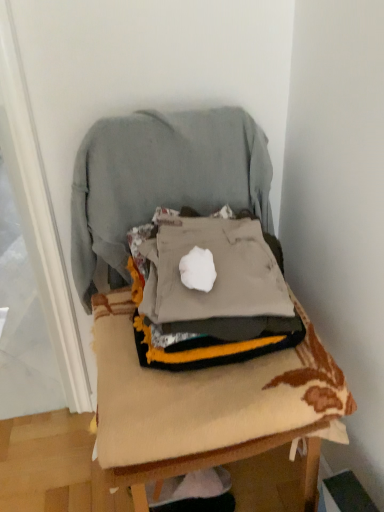
Question: Considering the relative sizes of gray fabric at center and textured beige cushion at center in the image provided, is gray fabric at center taller than textured beige cushion at center?

Choices:
 (A) no
 (B) yes

Answer: (A)

Question: Considering the relative positions of gray fabric at center and textured beige cushion at center in the image provided, is gray fabric at center to the right of textured beige cushion at center from the viewer's perspective?

Choices:
 (A) no
 (B) yes

Answer: (B)

Question: Is gray fabric at center positioned in front of textured beige cushion at center?

Choices:
 (A) no
 (B) yes

Answer: (A)

Question: From the image's perspective, is gray fabric at center below textured beige cushion at center?

Choices:
 (A) yes
 (B) no

Answer: (A)

Question: Would you say gray fabric at center is outside textured beige cushion at center?

Choices:
 (A) yes
 (B) no

Answer: (B)

Question: From their relative heights in the image, would you say gray fabric at center is taller or shorter than textured beige cushion at center?

Choices:
 (A) tall
 (B) short

Answer: (B)

Question: From the image's perspective, is gray fabric at center above or below textured beige cushion at center?

Choices:
 (A) above
 (B) below

Answer: (B)

Question: Is gray fabric at center wider or thinner than textured beige cushion at center?

Choices:
 (A) wide
 (B) thin

Answer: (B)

Question: Considering the relative positions of gray fabric at center and textured beige cushion at center in the image provided, is gray fabric at center to the left or to the right of textured beige cushion at center?

Choices:
 (A) right
 (B) left

Answer: (A)

Question: Considering the positions of point (92, 211) and point (120, 473), is point (92, 211) closer or farther from the camera than point (120, 473)?

Choices:
 (A) farther
 (B) closer

Answer: (A)

Question: In terms of size, does gray cotton sweatshirt at center appear bigger or smaller than textured beige cushion at center?

Choices:
 (A) small
 (B) big

Answer: (A)

Question: Visually, is gray cotton sweatshirt at center positioned to the left or to the right of textured beige cushion at center?

Choices:
 (A) left
 (B) right

Answer: (A)

Question: From their relative heights in the image, would you say gray cotton sweatshirt at center is taller or shorter than textured beige cushion at center?

Choices:
 (A) tall
 (B) short

Answer: (B)

Question: From a real-world perspective, is gray cotton sweatshirt at center physically located above or below gray fabric at center?

Choices:
 (A) above
 (B) below

Answer: (A)

Question: Do you think gray cotton sweatshirt at center is within gray fabric at center, or outside of it?

Choices:
 (A) inside
 (B) outside

Answer: (B)